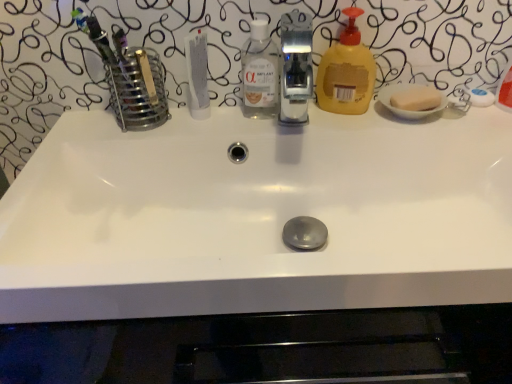
Image resolution: width=512 pixels, height=384 pixels. I want to click on vacant space in between white matte tube at center and satin nickel faucet at center, so click(x=240, y=122).